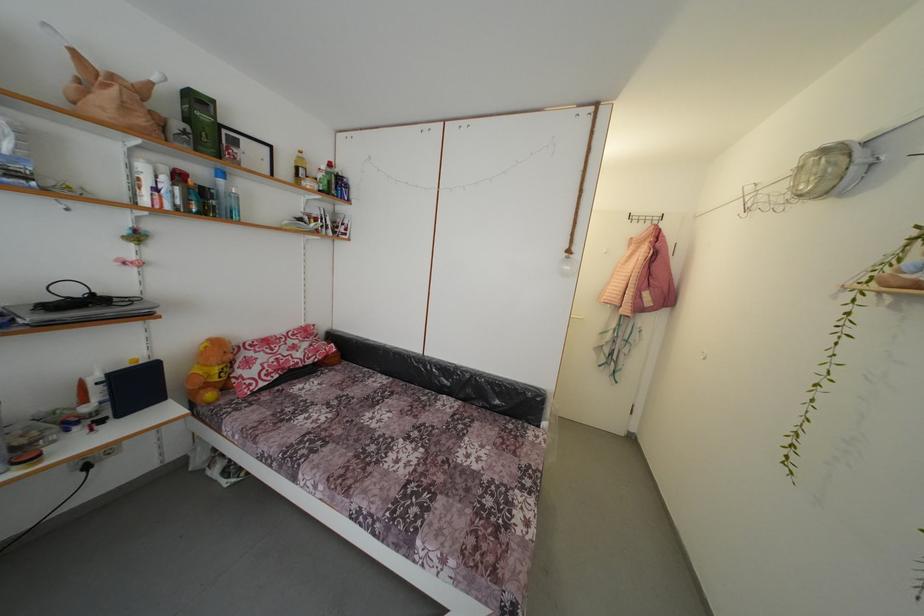
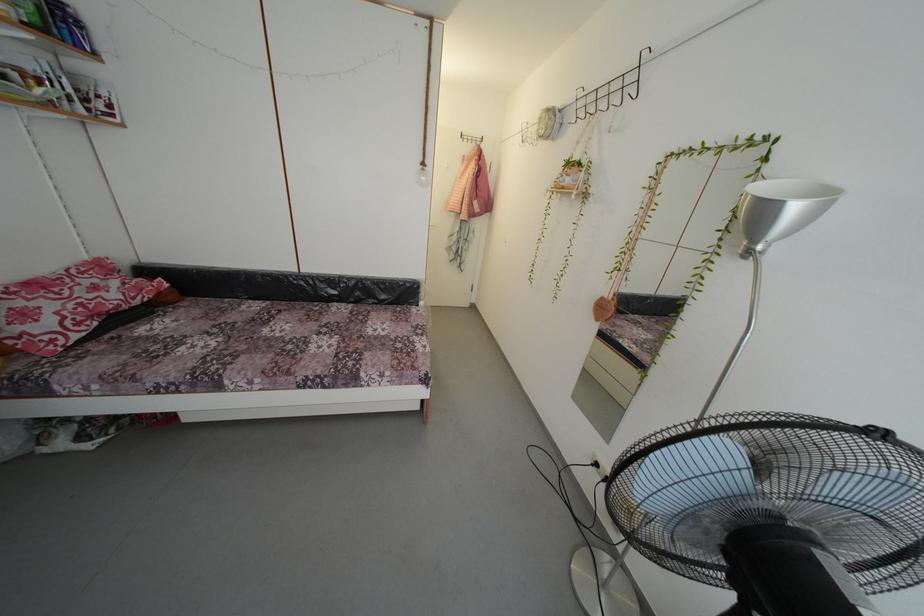
Locate, in the second image, the point that corresponds to the point at 261,358 in the first image.

(34, 306)